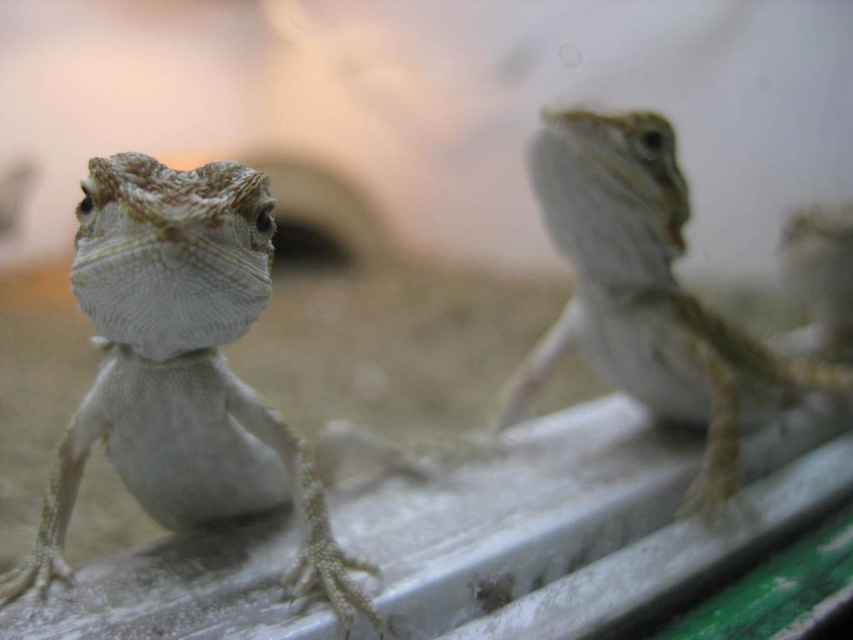
Question: Which object appears closest to the camera in this image?

Choices:
 (A) smooth beige lizard at upper right
 (B) smooth beige lizard at center

Answer: (B)

Question: Is the position of smooth beige lizard at center less distant than that of smooth beige lizard at upper right?

Choices:
 (A) yes
 (B) no

Answer: (A)

Question: From the image, what is the correct spatial relationship of smooth beige lizard at center in relation to smooth beige lizard at upper right?

Choices:
 (A) right
 (B) left

Answer: (B)

Question: Is smooth beige lizard at center bigger than smooth beige lizard at upper right?

Choices:
 (A) yes
 (B) no

Answer: (B)